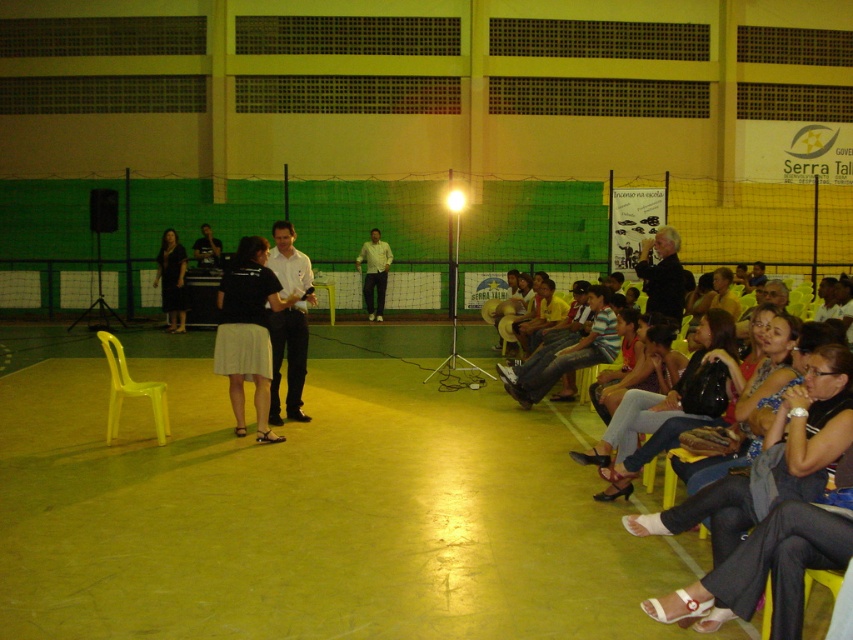
You are an event organizer who needs to place a 2.5 meter long banner between the black fabric skirt at center and the denim jeans at lower right. Will there be enough space to stretch the banner between them without folding it?

The distance between the black fabric skirt at center and the denim jeans at lower right is 3.31 meters. Since the banner is 2.5 meters long, there is sufficient space to stretch it between them without folding.

You are attending an indoor event in a gymnasium and notice a black dress at center and a yellow plastic chair at center. Which object is positioned lower in the image?

The black dress at center is located below the yellow plastic chair at center, so the black dress at center is positioned lower in the image.

You are standing in the gymnasium and want to place a small decoration exactly halfway between point (167, 326) and point (328, 296). Will the decoration be closer to the stage or the audience area?

The decoration placed halfway between point (167, 326) and point (328, 296) will be closer to the audience area since point (167, 326) is closer to the camera than point (328, 296), and the audience area is in front of the camera.